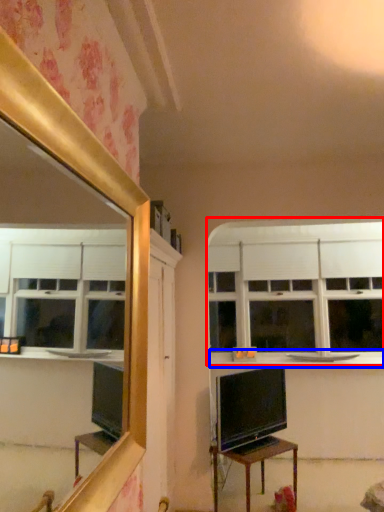
Question: Among these objects, which one is nearest to the camera, window (highlighted by a red box) or counter top (highlighted by a blue box)?

Choices:
 (A) window
 (B) counter top

Answer: (B)